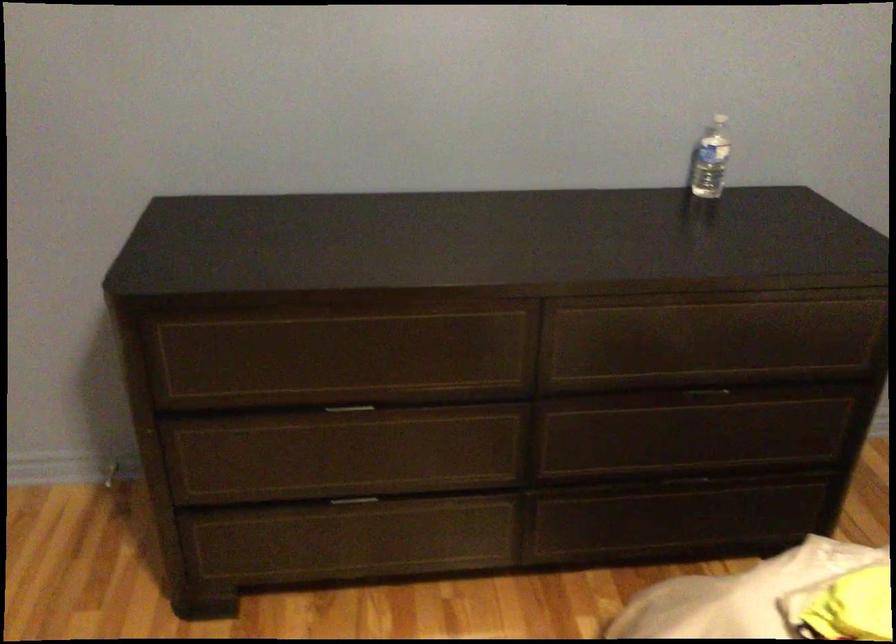
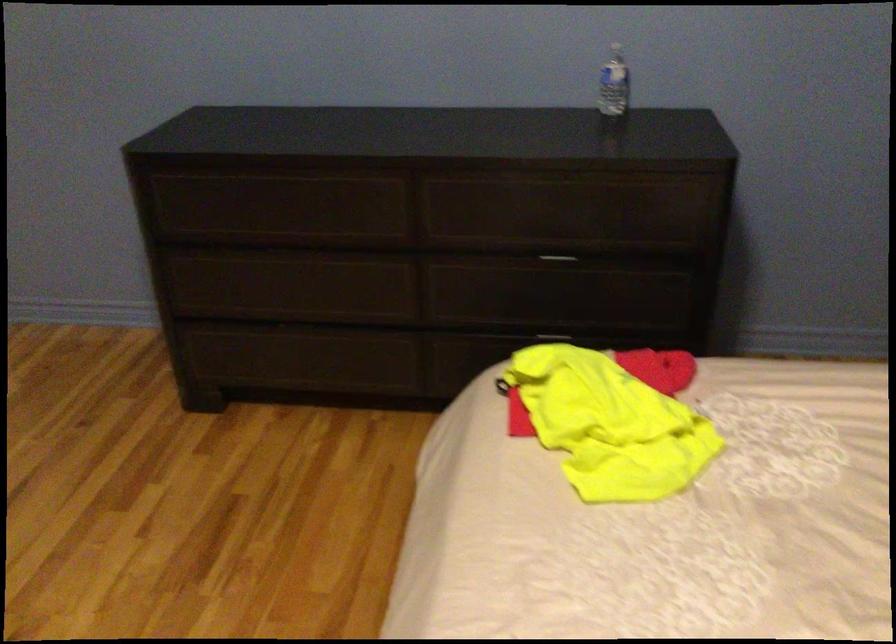
Locate, in the second image, the point that corresponds to point (693, 477) in the first image.

(553, 333)